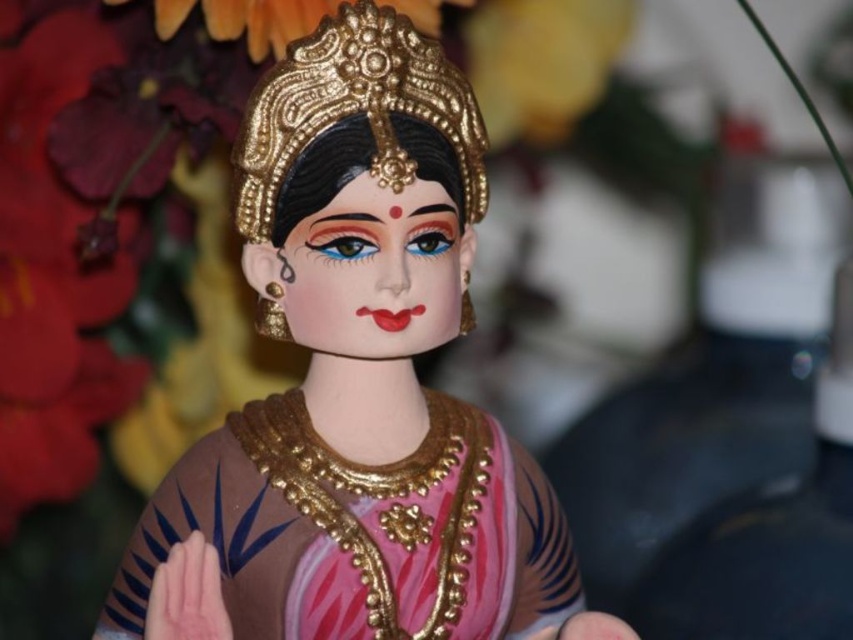
Question: Is matte gold statue at center closer to the viewer compared to gold textured crown at upper center?

Choices:
 (A) no
 (B) yes

Answer: (B)

Question: Is matte gold statue at center thinner than gold textured crown at upper center?

Choices:
 (A) no
 (B) yes

Answer: (A)

Question: Observing the image, what is the correct spatial positioning of matte gold statue at center in reference to gold textured crown at upper center?

Choices:
 (A) above
 (B) below

Answer: (B)